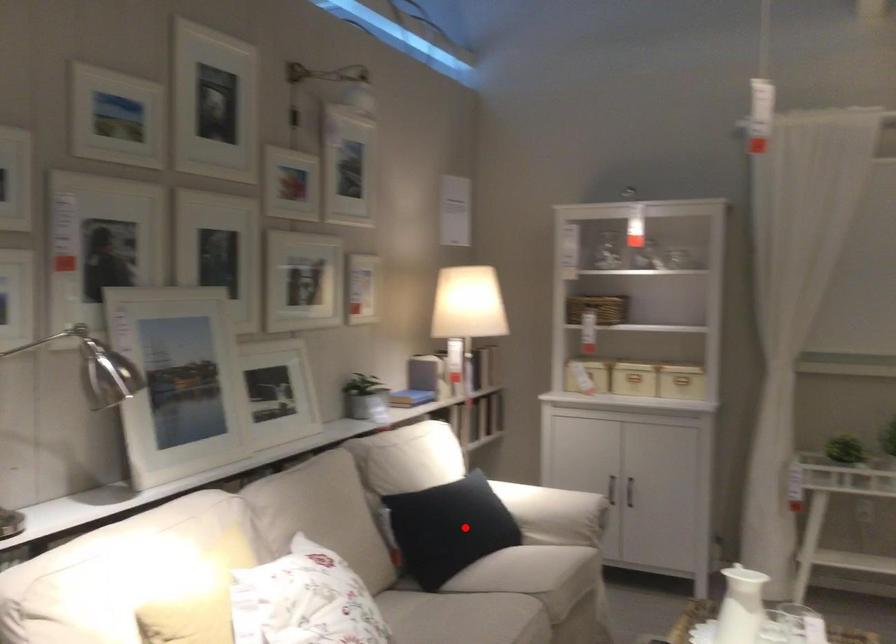
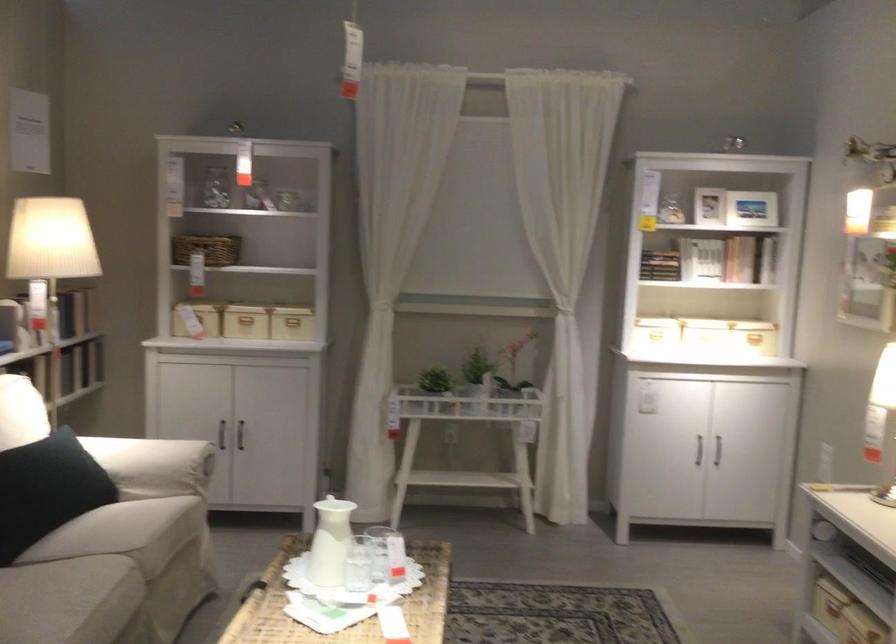
Where in the second image is the point corresponding to the highlighted location from the first image?

(47, 489)